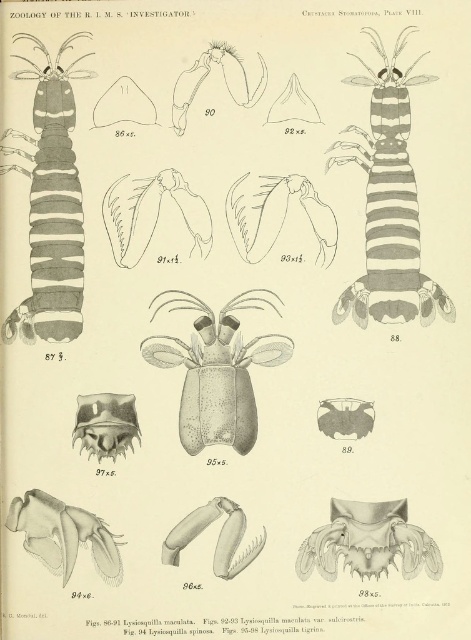
Question: Can you confirm if striped paper shrimp at upper right is smaller than matte grayish-brown shrimp at center?

Choices:
 (A) yes
 (B) no

Answer: (B)

Question: Where is striped paper shrimp at left located in relation to matte grayish-brown shrimp at center in the image?

Choices:
 (A) above
 (B) below

Answer: (A)

Question: Which point is farther to the camera?

Choices:
 (A) matte grayish-brown shrimp at center
 (B) striped paper shrimp at upper right
 (C) striped paper shrimp at left

Answer: (A)

Question: Which point is closer to the camera?

Choices:
 (A) striped paper shrimp at left
 (B) matte grayish-brown shrimp at center

Answer: (A)

Question: Which object is closer to the camera taking this photo?

Choices:
 (A) striped paper shrimp at left
 (B) matte grayish-brown shrimp at center
 (C) striped paper shrimp at upper right

Answer: (A)

Question: Is striped paper shrimp at upper right positioned before striped paper shrimp at left?

Choices:
 (A) yes
 (B) no

Answer: (B)